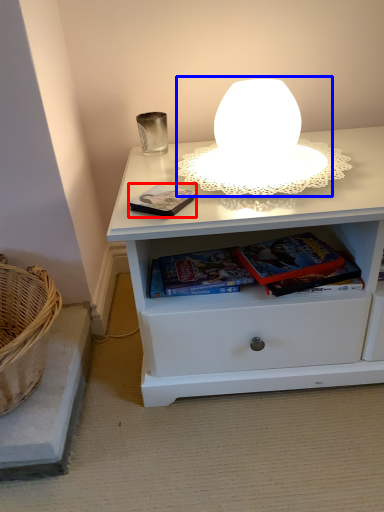
Question: Which of the following is the farthest to the observer, paperback book (highlighted by a red box) or table lamp (highlighted by a blue box)?

Choices:
 (A) paperback book
 (B) table lamp

Answer: (A)